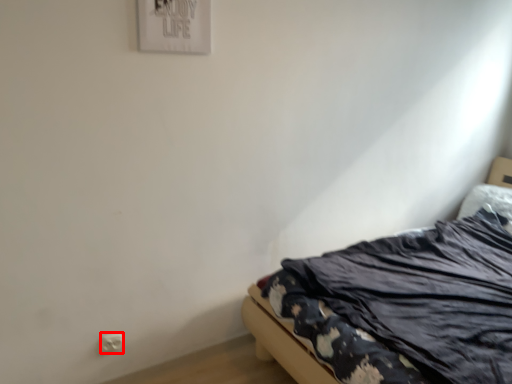
Question: From the image's perspective, where is electric outlet (annotated by the red box) located in relation to bed in the image?

Choices:
 (A) below
 (B) above

Answer: (A)